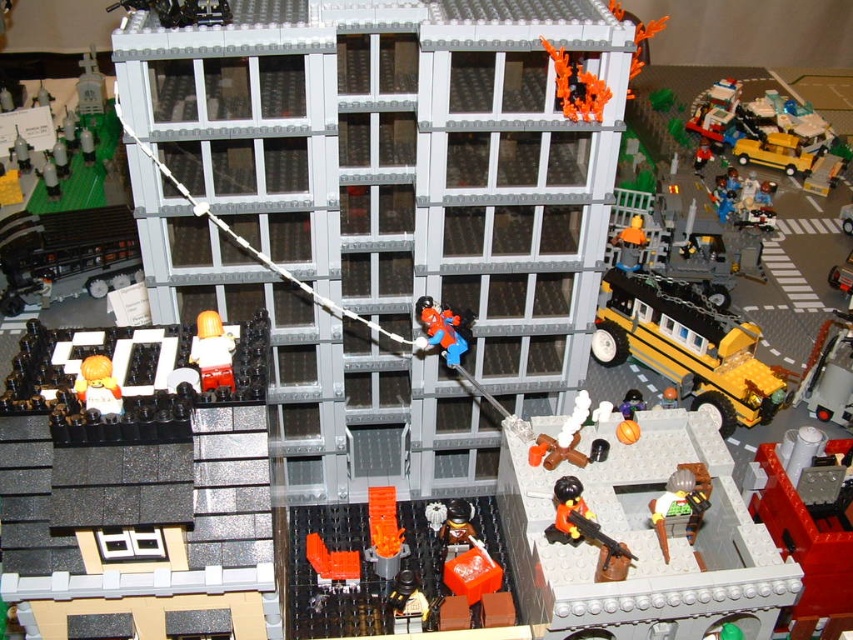
Is point (223, 406) closer to viewer compared to point (405, 570)?

Yes, point (223, 406) is in front of point (405, 570).

Which is more to the left, black glossy minifigure at upper left or smooth black figure at center?

black glossy minifigure at upper left is more to the left.

Identify the location of black glossy minifigure at upper left. [x=137, y=502].

Between matte black car at left and orange matte figure at center, which one is positioned lower?

orange matte figure at center is lower down.

Does matte black car at left appear on the left side of orange matte figure at center?

Yes, matte black car at left is to the left of orange matte figure at center.

Find the location of a particular element. matte black car at left is located at coordinates (65, 252).

Where is `smooth orange minifigure at center`? smooth orange minifigure at center is located at coordinates (212, 352).